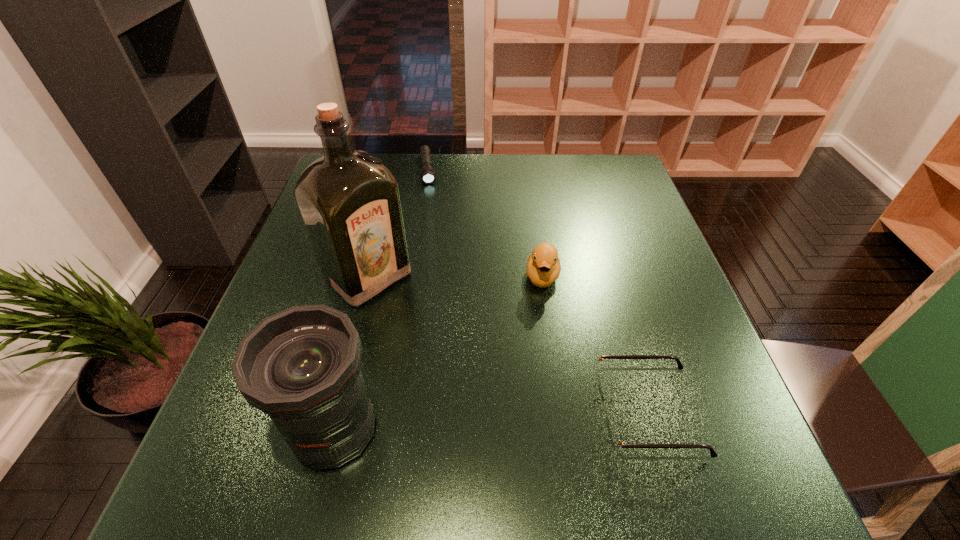
Locate an element on the screen. The image size is (960, 540). vacant region located 0.300m at the lens end of the shortest object is located at coordinates (435, 253).

At what (x,y) coordinates should I click in order to perform the action: click on object located at the far edge. Please return your answer as a coordinate pair (x, y). Looking at the image, I should click on (428, 175).

What are the coordinates of `telephoto lens that is at the near edge` in the screenshot? It's located at (301, 366).

Identify the location of spectacles situated at the near edge. (616, 444).

Identify the location of telephoto lens present at the left edge. The height and width of the screenshot is (540, 960). (301, 366).

This screenshot has height=540, width=960. I want to click on liquor that is positioned at the left edge, so click(x=349, y=201).

You are a GUI agent. You are given a task and a screenshot of the screen. Output one action in this format:
    pyautogui.click(x=<x>, y=<y>)
    Task: Click on the object at the right edge
    The height and width of the screenshot is (540, 960).
    Given the screenshot: What is the action you would take?
    pyautogui.click(x=616, y=444)

Find the location of a particular element. object positioned at the near left corner is located at coordinates (301, 366).

The width and height of the screenshot is (960, 540). Identify the location of object at the near right corner. (616, 444).

Find the location of `free region at the far edge`. free region at the far edge is located at coordinates (465, 168).